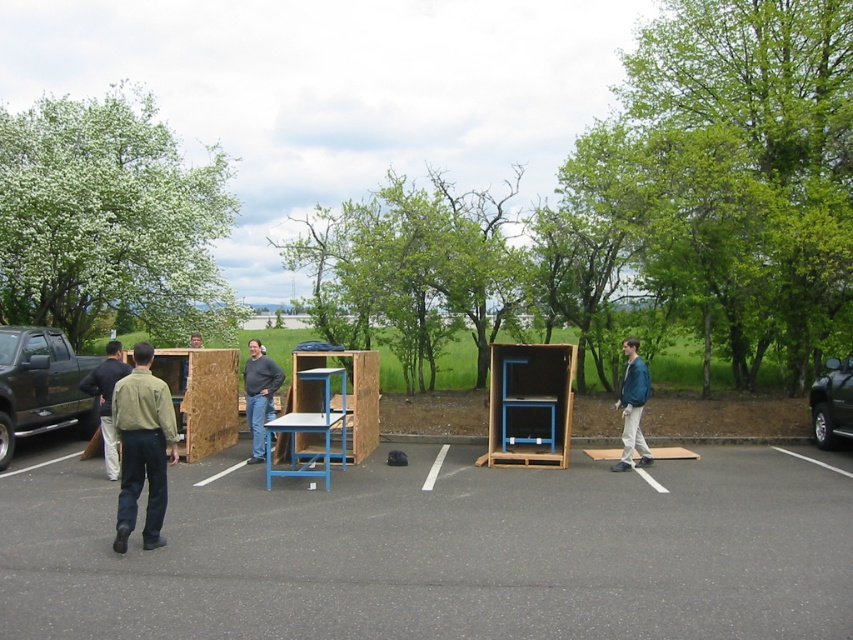
Question: Which of the following is the closest to the observer?

Choices:
 (A) (251, 422)
 (B) (624, 400)
 (C) (833, 436)

Answer: (B)

Question: Can you confirm if black glossy truck at right is positioned above dark blue shirt at left?

Choices:
 (A) no
 (B) yes

Answer: (A)

Question: Which object is closer to the camera taking this photo?

Choices:
 (A) black glossy truck at right
 (B) green matte shirt at left

Answer: (B)

Question: Does matte black shirt at center lie behind dark blue shirt at left?

Choices:
 (A) yes
 (B) no

Answer: (A)

Question: Is dark gray asphalt at center above matte black shirt at center?

Choices:
 (A) yes
 (B) no

Answer: (B)

Question: Estimate the real-world distances between objects in this image. Which object is closer to the black matte truck at left?

Choices:
 (A) dark blue shirt at left
 (B) blue leather jacket at right
 (C) matte black shirt at center
 (D) green matte shirt at left

Answer: (A)